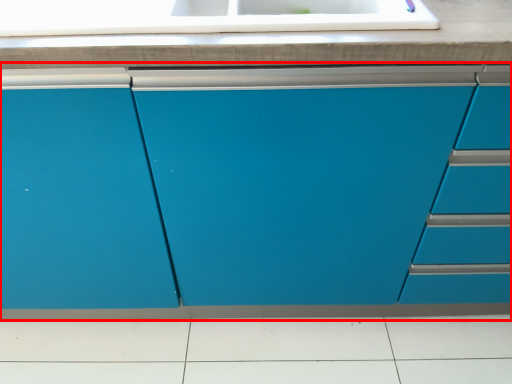
Question: Observing the image, what is the correct spatial positioning of cabinetry (annotated by the red box) in reference to countertop?

Choices:
 (A) left
 (B) right

Answer: (B)